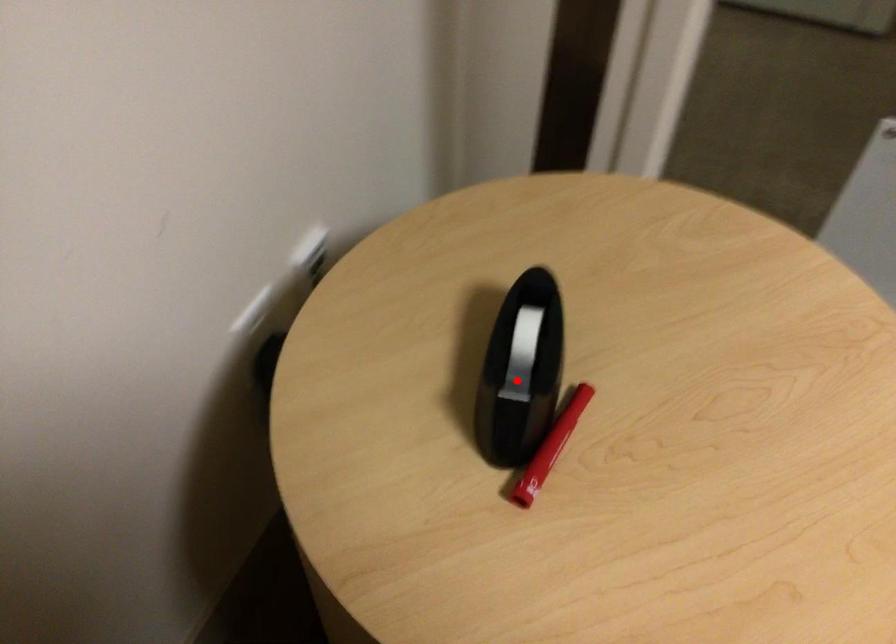
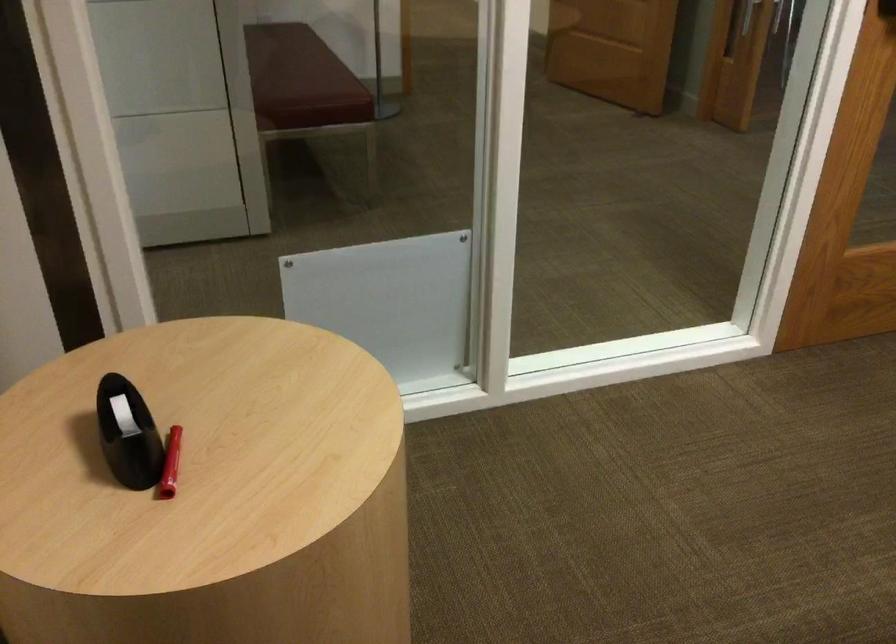
Question: I am providing you with two images of the same scene from different viewpoints. Image1 has a red point marked. In image2, the corresponding 3D location appears at what relative position? Reply with the corresponding letter.

Choices:
 (A) Closer
 (B) Farther

Answer: (B)